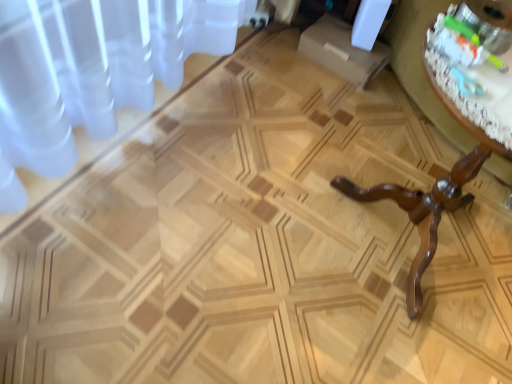
Image resolution: width=512 pixels, height=384 pixels. Describe the element at coordinates (430, 196) in the screenshot. I see `wooden table at right` at that location.

The height and width of the screenshot is (384, 512). Identify the location of wooden table at right. (430, 196).

What do you see at coordinates (470, 79) in the screenshot? I see `translucent glass bowl at upper right` at bounding box center [470, 79].

This screenshot has width=512, height=384. What are the coordinates of `translucent glass bowl at upper right` in the screenshot? It's located at (470, 79).

What is the approximate width of translucent glass bowl at upper right?

It is 11.24 inches.

The height and width of the screenshot is (384, 512). In order to click on wooden table at right in this screenshot , I will do `click(430, 196)`.

In the image, is wooden table at right on the left side or the right side of translucent glass bowl at upper right?

In the image, wooden table at right appears on the right side of translucent glass bowl at upper right.

Considering their positions, is wooden table at right located in front of or behind translucent glass bowl at upper right?

In the image, wooden table at right appears in front of translucent glass bowl at upper right.

Considering the points (481, 131) and (508, 102), which point is behind, point (481, 131) or point (508, 102)?

Point (508, 102)

From the image's perspective, which one is positioned lower, wooden table at right or translucent glass bowl at upper right?

wooden table at right, from the image's perspective.

From a real-world perspective, who is located lower, wooden table at right or translucent glass bowl at upper right?

wooden table at right, from a real-world perspective.

Considering the relative sizes of wooden table at right and translucent glass bowl at upper right in the image provided, is wooden table at right wider than translucent glass bowl at upper right?

Correct, the width of wooden table at right exceeds that of translucent glass bowl at upper right.

Who is shorter, wooden table at right or translucent glass bowl at upper right?

translucent glass bowl at upper right.

Considering the relative sizes of wooden table at right and translucent glass bowl at upper right in the image provided, is wooden table at right smaller than translucent glass bowl at upper right?

No, wooden table at right is not smaller than translucent glass bowl at upper right.

Can translucent glass bowl at upper right be found inside wooden table at right?

That's correct, translucent glass bowl at upper right is inside wooden table at right.

Is there a large distance between wooden table at right and translucent glass bowl at upper right?

No, wooden table at right is in close proximity to translucent glass bowl at upper right.

Based on the photo, is wooden table at right oriented towards translucent glass bowl at upper right?

No, wooden table at right is not facing towards translucent glass bowl at upper right.

Identify the location of round table located above the wooden table at right (from a real-world perspective). (470, 79).

Consider the image. Which object is positioned more to the right, translucent glass bowl at upper right or wooden table at right?

From the viewer's perspective, wooden table at right appears more on the right side.

In the image, is translucent glass bowl at upper right positioned in front of or behind wooden table at right?

Clearly, translucent glass bowl at upper right is behind wooden table at right.

Is point (467, 101) positioned behind point (423, 44)?

No.

From the image's perspective, which one is positioned higher, translucent glass bowl at upper right or wooden table at right?

From the image's view, translucent glass bowl at upper right is above.

From a real-world perspective, relative to wooden table at right, is translucent glass bowl at upper right vertically above or below?

In terms of real-world spatial position, translucent glass bowl at upper right is above wooden table at right.

Can you confirm if translucent glass bowl at upper right is wider than wooden table at right?

Incorrect, the width of translucent glass bowl at upper right does not surpass that of wooden table at right.

In terms of height, does translucent glass bowl at upper right look taller or shorter compared to wooden table at right?

Clearly, translucent glass bowl at upper right is shorter compared to wooden table at right.

Considering the sizes of objects translucent glass bowl at upper right and wooden table at right in the image provided, who is bigger, translucent glass bowl at upper right or wooden table at right?

Bigger between the two is wooden table at right.

Is translucent glass bowl at upper right spatially inside wooden table at right, or outside of it?

The correct answer is: inside.

Based on the photo, is there a large distance between translucent glass bowl at upper right and wooden table at right?

translucent glass bowl at upper right is actually quite close to wooden table at right.

Could you tell me if translucent glass bowl at upper right is facing wooden table at right?

No, translucent glass bowl at upper right is not turned towards wooden table at right.

Consider the image. Can you tell me how much translucent glass bowl at upper right and wooden table at right differ in facing direction?

The facing directions of translucent glass bowl at upper right and wooden table at right are 0.000176 degrees apart.

I want to click on table to the right of translucent glass bowl at upper right, so click(430, 196).

Where is `round table lying on the left of wooden table at right`? round table lying on the left of wooden table at right is located at coordinates (470, 79).

What are the coordinates of `table in front of the translucent glass bowl at upper right` in the screenshot? It's located at (430, 196).